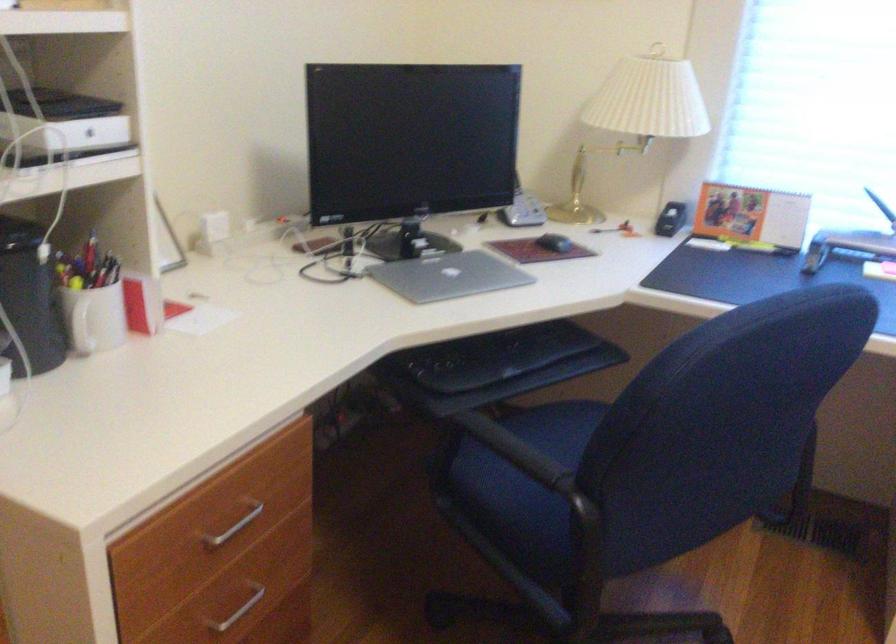
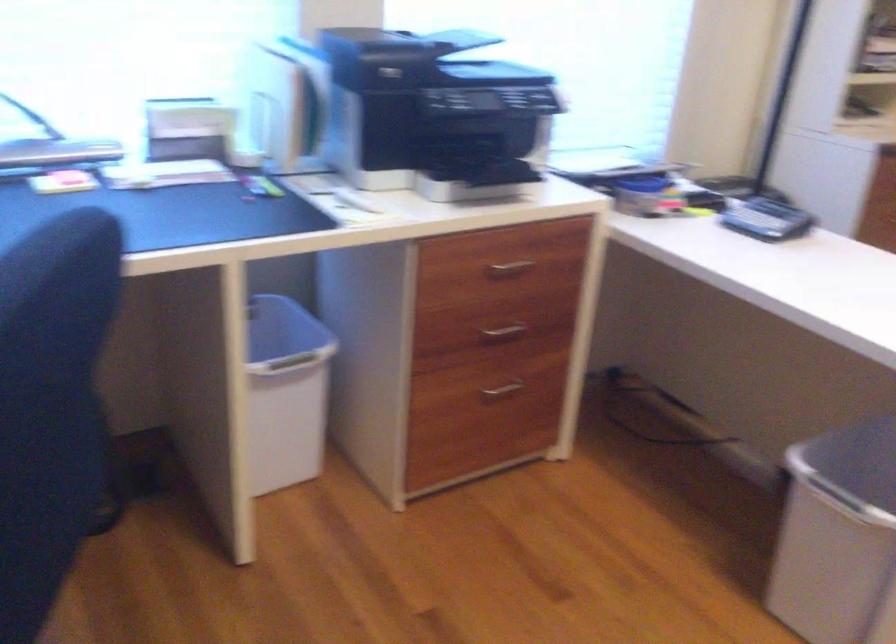
From the picture: Based on the continuous images, in which direction is the camera rotating?

The camera's rotation is toward right-down.